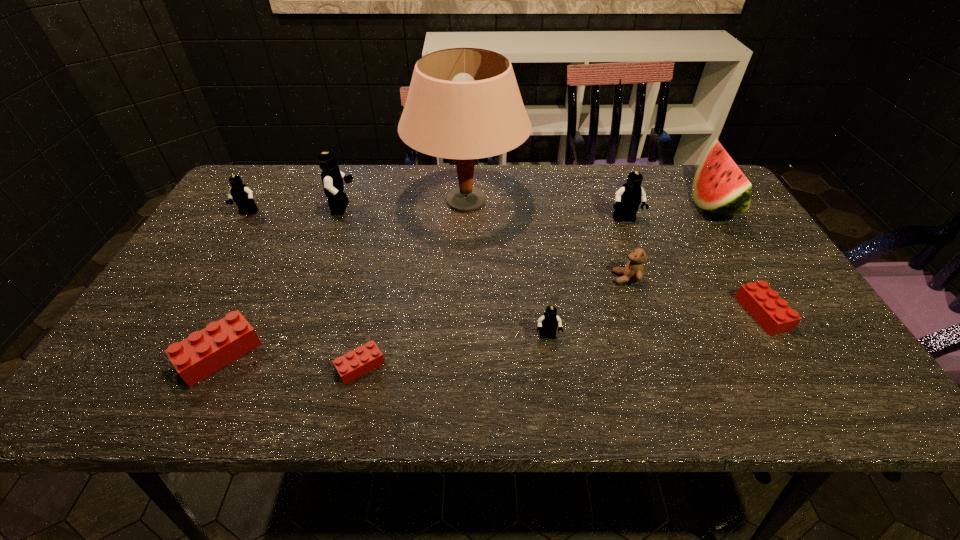
This screenshot has height=540, width=960. What are the coordinates of `vacant space located 0.270m on the front-facing side of the third black Lego from right to left` in the screenshot? It's located at (446, 208).

Locate an element on the screen. free space located on the outer rind of the watermelon is located at coordinates (617, 204).

Locate an element on the screen. vacant area situated 0.080m on the outer rind of the watermelon is located at coordinates [x=664, y=204].

Find the location of a particular element. vacant space located 0.120m on the outer rind of the watermelon is located at coordinates (651, 204).

Identify the location of vacant position located on the front-facing side of the rightmost black Lego. The width and height of the screenshot is (960, 540). (653, 294).

Where is `blank space located on the front-facing side of the leftmost Lego`? This screenshot has height=540, width=960. blank space located on the front-facing side of the leftmost Lego is located at coordinates (180, 324).

You are a GUI agent. You are given a task and a screenshot of the screen. Output one action in this format:
    pyautogui.click(x=<x>, y=<y>)
    Task: Click on the free space located 0.260m on the front-facing side of the sixth farthest object
    The image size is (960, 540).
    Given the screenshot: What is the action you would take?
    pyautogui.click(x=508, y=278)

Locate an element on the screen. The image size is (960, 540). free region located 0.130m on the front-facing side of the sixth farthest object is located at coordinates (561, 278).

In order to click on vacant area situated on the front-facing side of the sixth farthest object in this screenshot , I will do `click(484, 278)`.

Identify the location of vacant space located 0.150m on the front-facing side of the fourth tallest Lego. This screenshot has width=960, height=540. (557, 407).